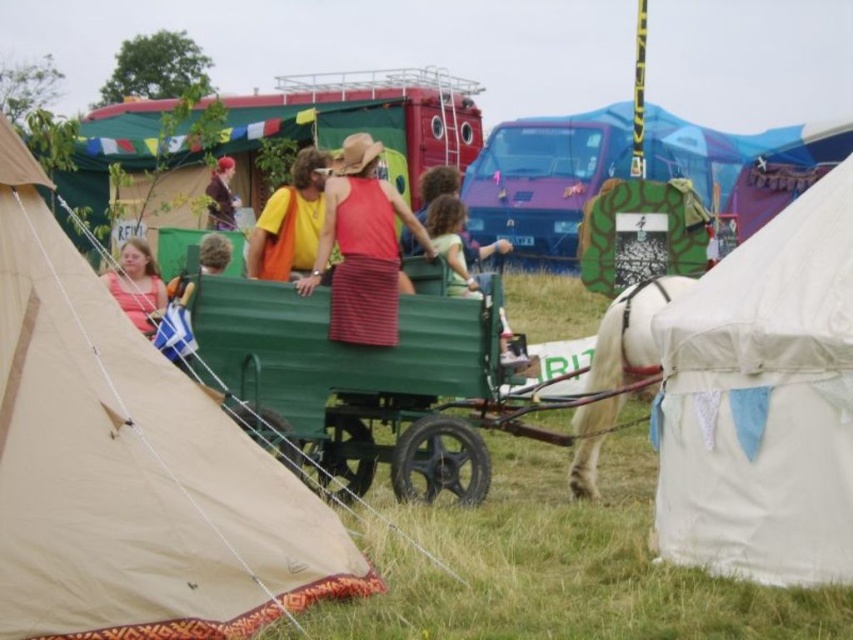
Question: Can you confirm if yellow cotton shirt at center is positioned to the right of curly-haired child at center?

Choices:
 (A) no
 (B) yes

Answer: (A)

Question: Which point is farther to the camera?

Choices:
 (A) (352, 490)
 (B) (229, 205)

Answer: (B)

Question: Is white canvas tent at lower right positioned at the back of yellow cotton shirt at center?

Choices:
 (A) no
 (B) yes

Answer: (A)

Question: Considering the real-world distances, which object is closest to the yellow cotton shirt at center?

Choices:
 (A) shiny brown jacket at center
 (B) white glossy horse at center
 (C) matte pink shirt at center

Answer: (C)

Question: Which of the following is the farthest from the observer?

Choices:
 (A) (410, 380)
 (B) (151, 300)

Answer: (B)

Question: Observing the image, what is the correct spatial positioning of matte pink shirt at center in reference to curly-haired child at center?

Choices:
 (A) left
 (B) right

Answer: (A)